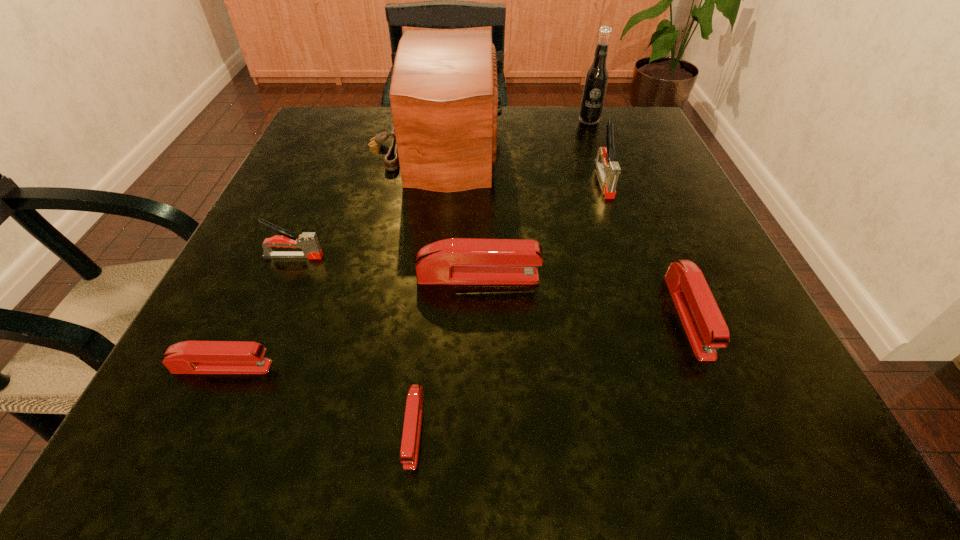
Where is `the seventh tallest object`? The image size is (960, 540). the seventh tallest object is located at coordinates (189, 357).

Locate an element on the screen. the shortest stapler is located at coordinates pyautogui.click(x=409, y=451).

Where is `the nearest object`? This screenshot has height=540, width=960. the nearest object is located at coordinates (409, 451).

Where is `vacant space situated on the front-facing side of the radio receiver`? The image size is (960, 540). vacant space situated on the front-facing side of the radio receiver is located at coordinates click(544, 145).

Locate an element on the screen. Image resolution: width=960 pixels, height=540 pixels. vacant space located 0.380m on the label of the root beer is located at coordinates (632, 237).

This screenshot has height=540, width=960. Find the location of `free location located 0.140m on the handle side of the right gray stapler`. free location located 0.140m on the handle side of the right gray stapler is located at coordinates (628, 252).

Identify the location of free point located on the handle side of the left gray stapler. Image resolution: width=960 pixels, height=540 pixels. (444, 256).

Identify the location of free point located on the front-facing side of the biggest red stapler. (579, 277).

What are the coordinates of `free location located 0.080m on the front-facing side of the third shortest stapler` in the screenshot? It's located at (733, 422).

Where is `free space located 0.320m on the front-facing side of the fifth tallest stapler`? This screenshot has height=540, width=960. free space located 0.320m on the front-facing side of the fifth tallest stapler is located at coordinates (528, 367).